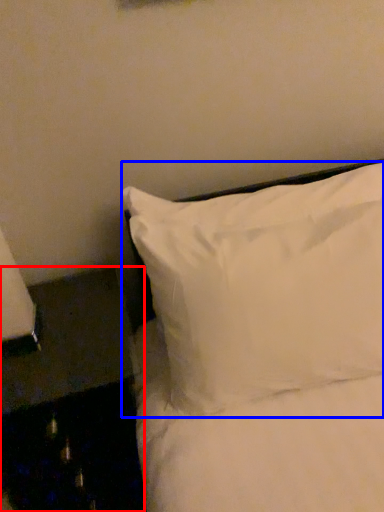
Question: Which object is closer to the camera taking this photo, furniture (highlighted by a red box) or pillow (highlighted by a blue box)?

Choices:
 (A) furniture
 (B) pillow

Answer: (B)